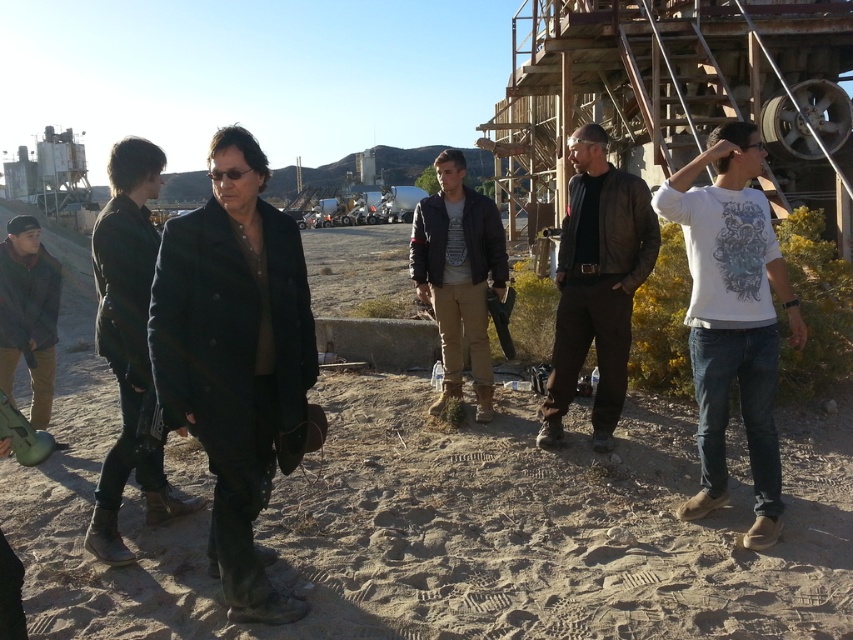
Can you confirm if white cotton t-shirt at right is positioned below brown leather jacket at center?

Yes, white cotton t-shirt at right is below brown leather jacket at center.

Is white cotton t-shirt at right taller than brown leather jacket at center?

In fact, white cotton t-shirt at right may be shorter than brown leather jacket at center.

The image size is (853, 640). I want to click on white cotton t-shirt at right, so click(x=732, y=317).

I want to click on white cotton t-shirt at right, so click(x=732, y=317).

Who is taller, white cotton t-shirt at right or dark denim jacket at center?

Standing taller between the two is dark denim jacket at center.

Is white cotton t-shirt at right positioned before dark denim jacket at center?

No, white cotton t-shirt at right is further to the viewer.

Locate an element on the screen. The image size is (853, 640). white cotton t-shirt at right is located at coordinates (732, 317).

Looking at this image, is the position of dirt field at center less distant than that of white cotton t-shirt at right?

Yes, dirt field at center is in front of white cotton t-shirt at right.

Is point (74, 317) positioned in front of point (770, 272)?

That is False.

Locate an element on the screen. dirt field at center is located at coordinates (447, 522).